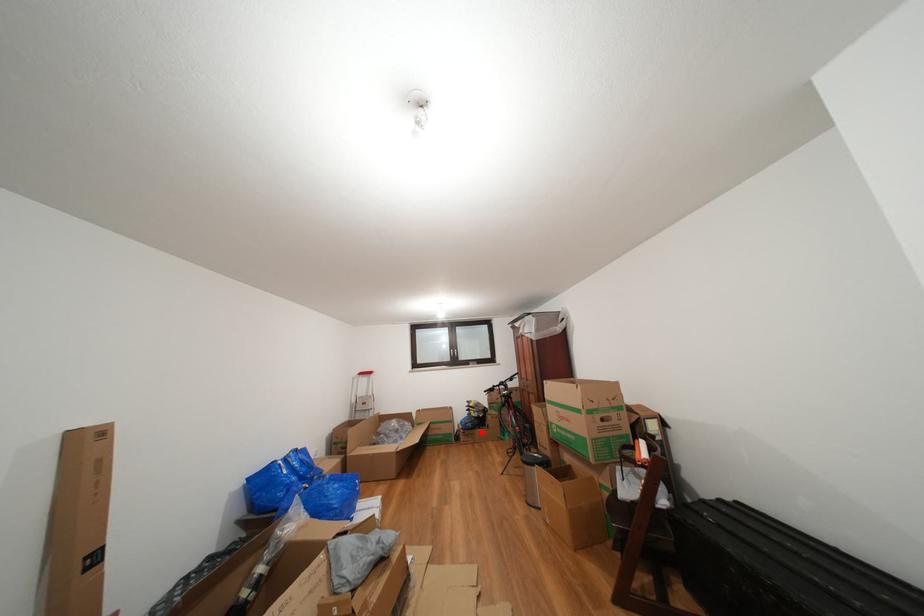
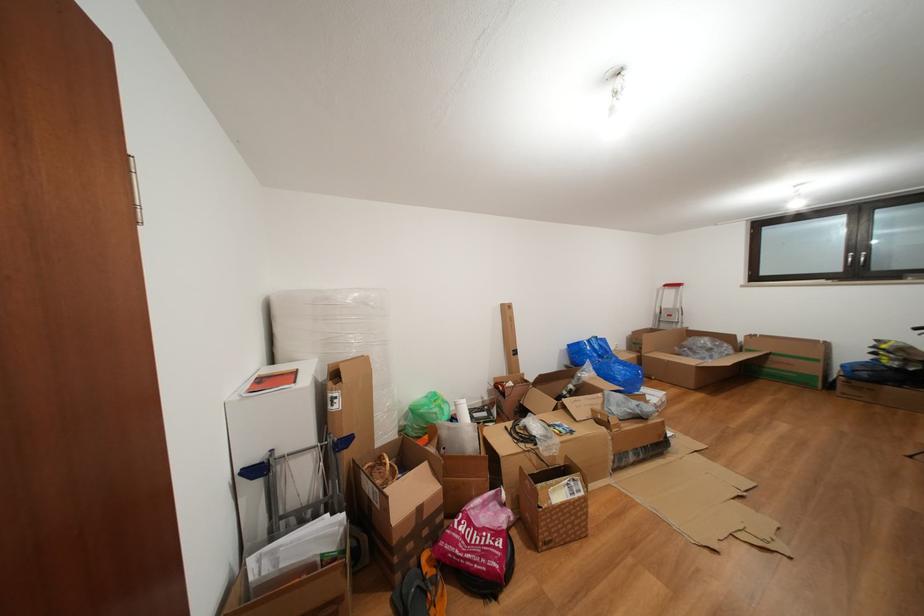
Find the pixel in the second image that matches the highlighted location in the first image.

(886, 387)